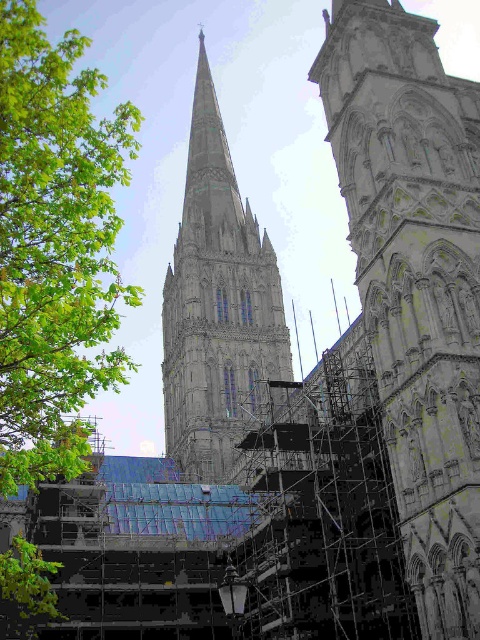
You are standing in front of the cathedral and want to take a photo of both the white stone tower at center and the stone steeple at center. Which one will appear larger in your photo?

The white stone tower at center will appear larger in the photo because it is closer to the viewer than the stone steeple at center.

You are standing in front of the cathedral and notice a point marked at coordinates (x=55, y=246). Based on the scene description, what object is located at that point?

The point at coordinates (x=55, y=246) indicates a green leafy tree at left.

You are an architect visiting the cathedral and notice two structures at the center. The white stone tower at center and the stone steeple at center. Which one is taller?

The stone steeple at center is taller than the white stone tower at center.